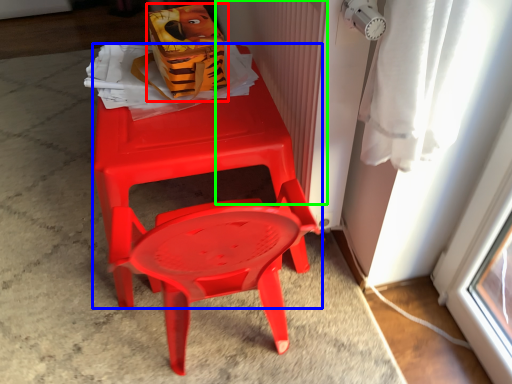
Question: Estimate the real-world distances between objects in this image. Which object is closer to lunch box (highlighted by a red box), chair (highlighted by a blue box) or radiator (highlighted by a green box)?

Choices:
 (A) chair
 (B) radiator

Answer: (A)